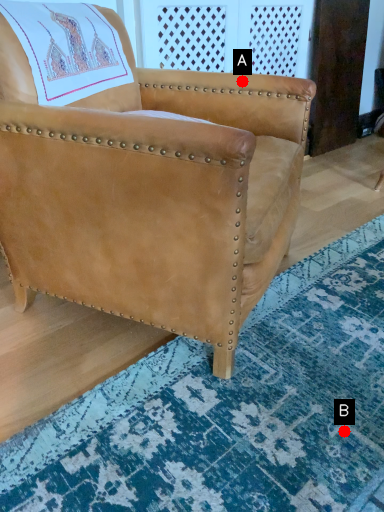
Question: Two points are circled on the image, labeled by A and B beside each circle. Which point is closer to the camera taking this photo?

Choices:
 (A) A is closer
 (B) B is closer

Answer: (B)